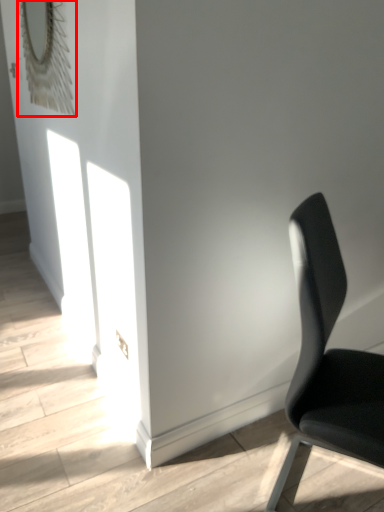
Question: Observing the image, what is the correct spatial positioning of mirror (annotated by the red box) in reference to chair?

Choices:
 (A) right
 (B) left

Answer: (B)